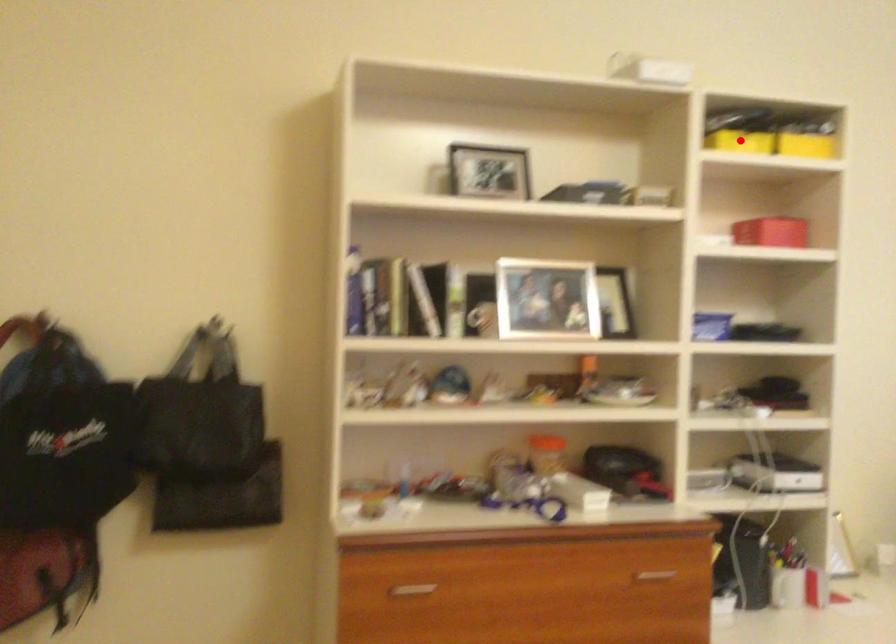
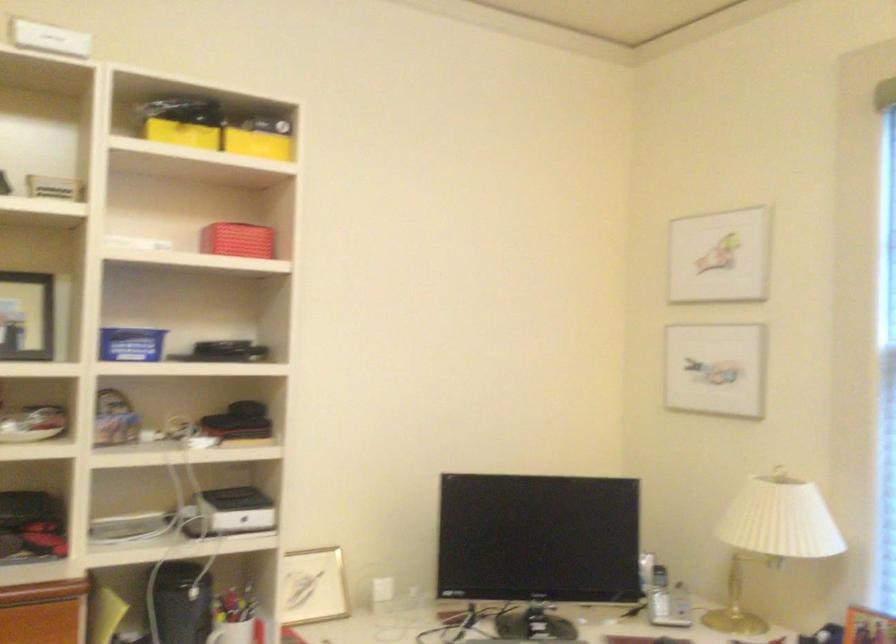
Question: I am providing you with two images of the same scene from different viewpoints. A red point is shown in image1. For the corresponding object point in image2, is it positioned nearer or farther from the camera?

Choices:
 (A) Nearer
 (B) Farther

Answer: (A)